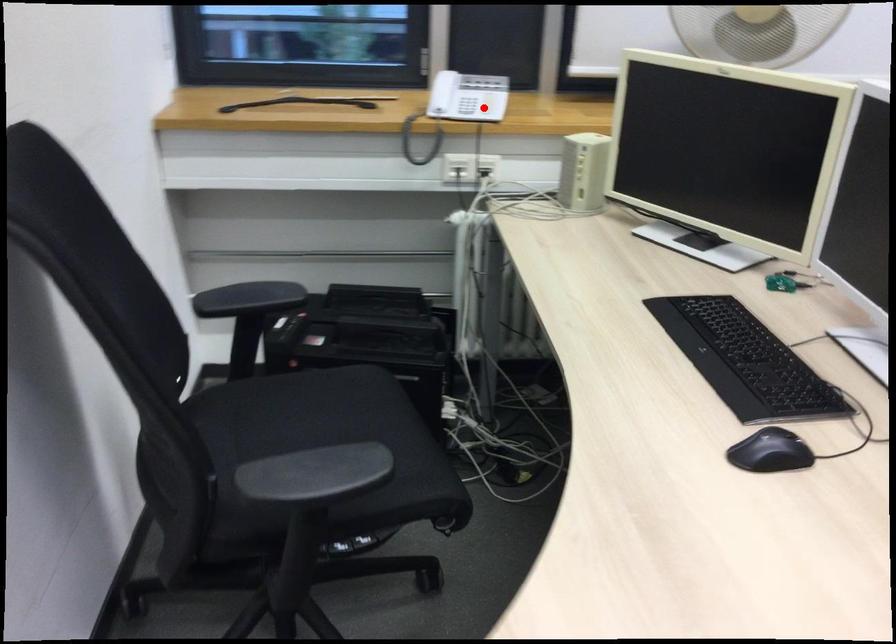
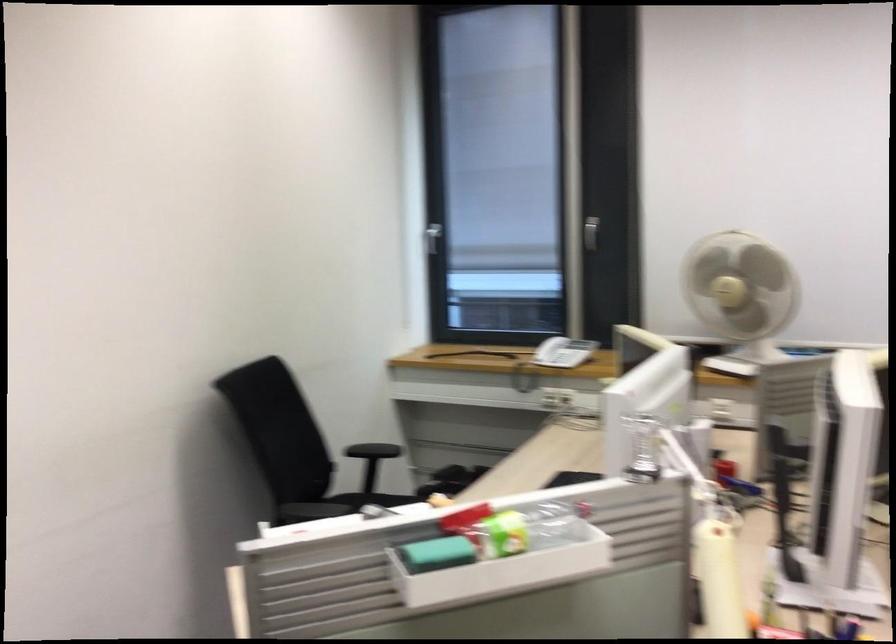
Question: A red point is marked in image1. In image2, is the corresponding 3D point closer to the camera or farther? Reply with the corresponding letter.

Choices:
 (A) The corresponding 3D point is closer.
 (B) The corresponding 3D point is farther.

Answer: (B)